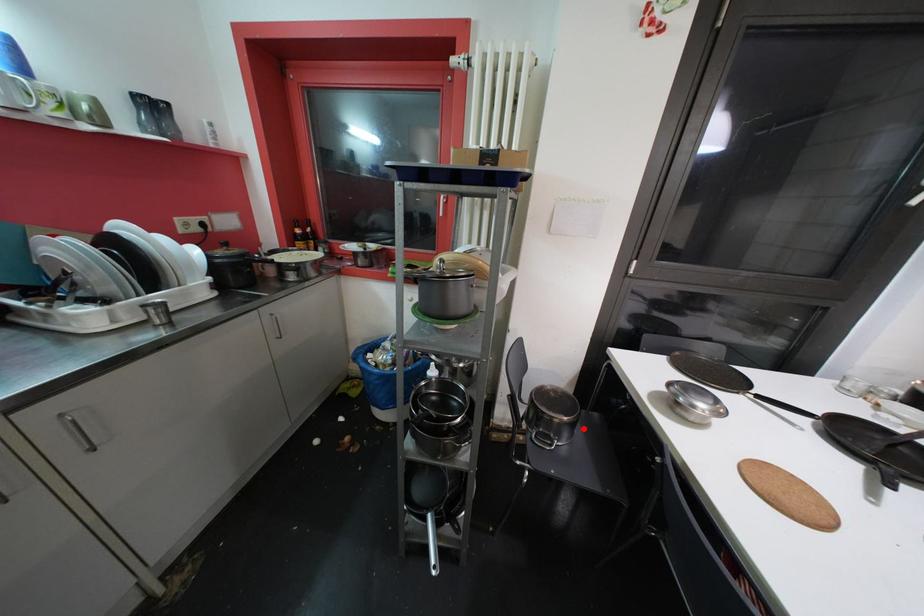
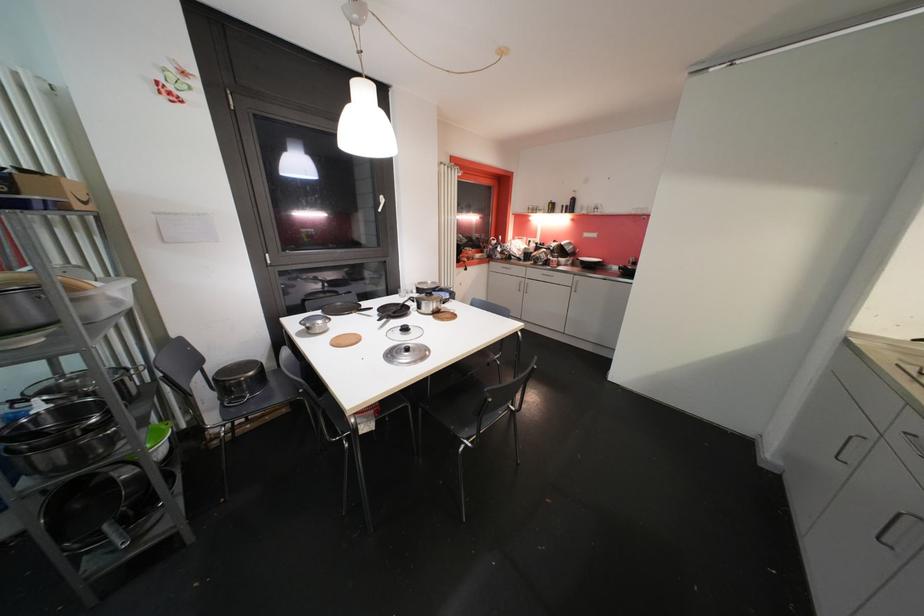
Question: A red point is marked in image1. In image2, is the corresponding 3D point closer to the camera or farther? Reply with the corresponding letter.

Choices:
 (A) The corresponding 3D point is closer.
 (B) The corresponding 3D point is farther.

Answer: (B)